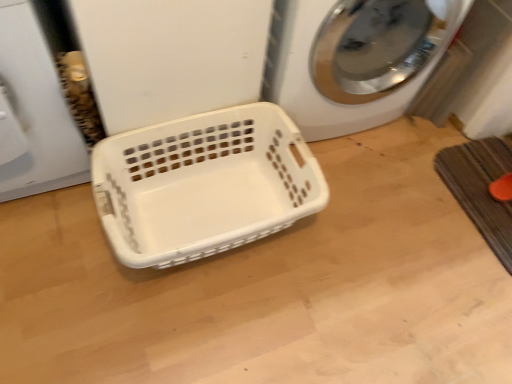
The image size is (512, 384). Find the location of `free space to the left of brown textured bath mat at lower right`. free space to the left of brown textured bath mat at lower right is located at coordinates (399, 192).